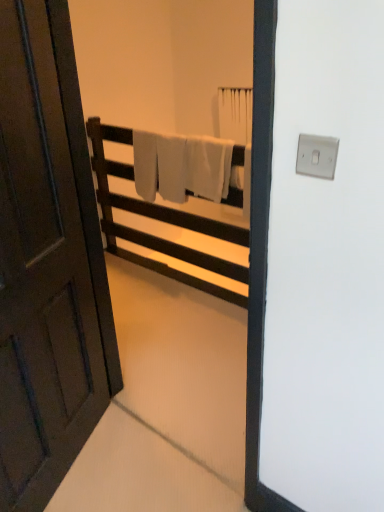
I want to click on vacant space in white soft towel at center (from a real-world perspective), so point(189,290).